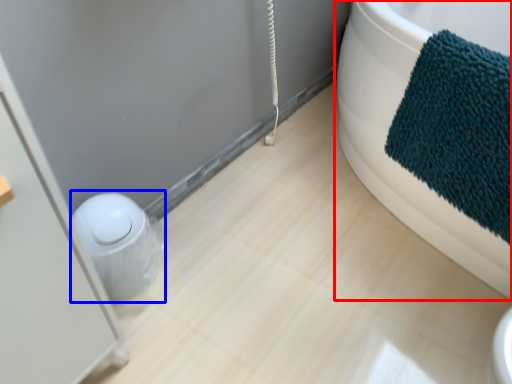
Question: Which object is closer to the camera taking this photo, bathtub (highlighted by a red box) or toilet bowl (highlighted by a blue box)?

Choices:
 (A) bathtub
 (B) toilet bowl

Answer: (A)